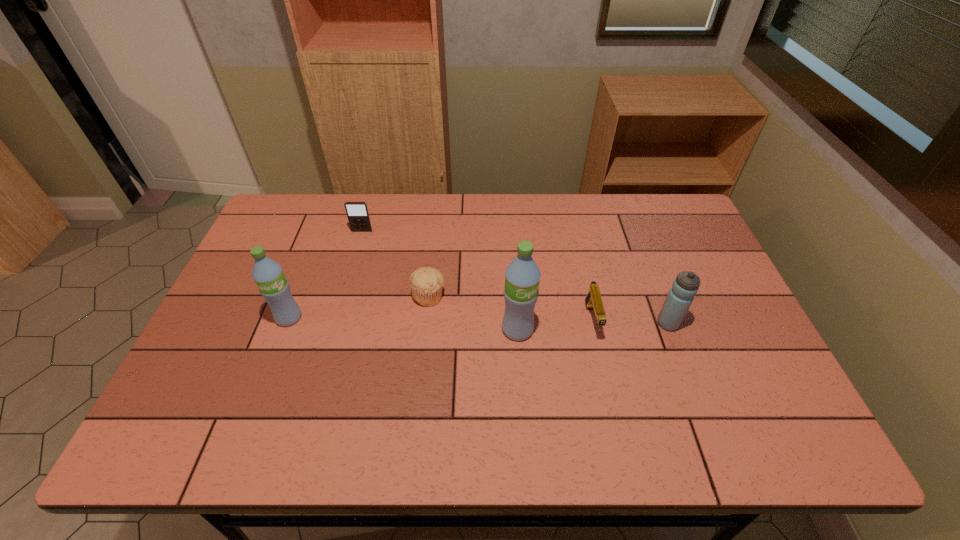
Find the location of a particular element. The height and width of the screenshot is (540, 960). free space at the left edge is located at coordinates (255, 245).

At what (x,y) coordinates should I click in order to perform the action: click on vacant space at the right edge. Please return your answer as a coordinate pair (x, y). This screenshot has height=540, width=960. Looking at the image, I should click on (671, 244).

This screenshot has width=960, height=540. I want to click on blank space at the far left corner, so click(286, 196).

In the image, there is a desktop. In order to click on free space at the far right corner in this screenshot , I will do `click(672, 193)`.

You are a GUI agent. You are given a task and a screenshot of the screen. Output one action in this format:
    pyautogui.click(x=<x>, y=<y>)
    Task: Click on the vacant area between the tallest water bottle and the rightmost water bottle
    The height and width of the screenshot is (540, 960).
    Given the screenshot: What is the action you would take?
    pyautogui.click(x=592, y=327)

You are a GUI agent. You are given a task and a screenshot of the screen. Output one action in this format:
    pyautogui.click(x=<x>, y=<y>)
    Task: Click on the vacant area that lies between the iPod and the leftmost object
    
    Given the screenshot: What is the action you would take?
    pyautogui.click(x=325, y=274)

This screenshot has height=540, width=960. I want to click on vacant space that's between the fourth object from right to left and the leftmost object, so click(359, 307).

Locate an element on the screen. The width and height of the screenshot is (960, 540). free space between the leftmost water bottle and the third object from left to right is located at coordinates click(359, 307).

At what (x,y) coordinates should I click in order to perform the action: click on vacant area that lies between the shortest water bottle and the muffin. Please return your answer as a coordinate pair (x, y). The height and width of the screenshot is (540, 960). Looking at the image, I should click on (548, 309).

You are a GUI agent. You are given a task and a screenshot of the screen. Output one action in this format:
    pyautogui.click(x=<x>, y=<y>)
    Task: Click on the empty space between the iPod and the muffin
    This screenshot has width=960, height=540.
    Given the screenshot: What is the action you would take?
    pyautogui.click(x=396, y=264)